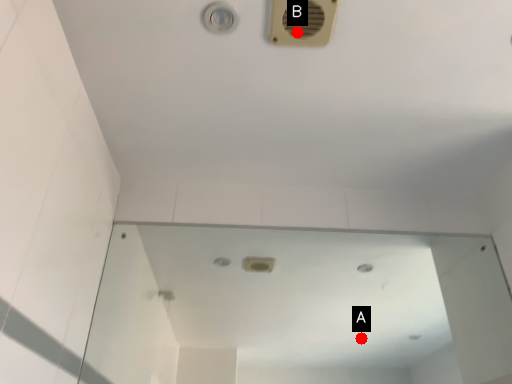
Question: Two points are circled on the image, labeled by A and B beside each circle. Which of the following is the closest to the observer?

Choices:
 (A) A is closer
 (B) B is closer

Answer: (B)